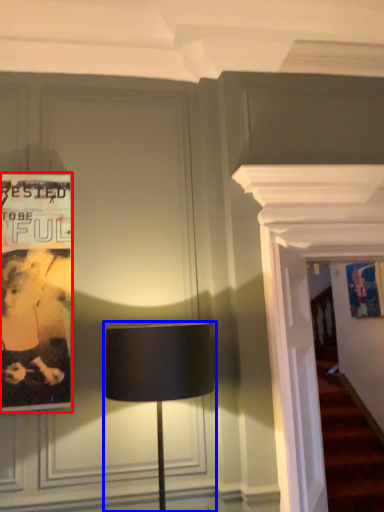
Question: Which object is closer to the camera taking this photo, poster (highlighted by a red box) or lamp (highlighted by a blue box)?

Choices:
 (A) poster
 (B) lamp

Answer: (B)